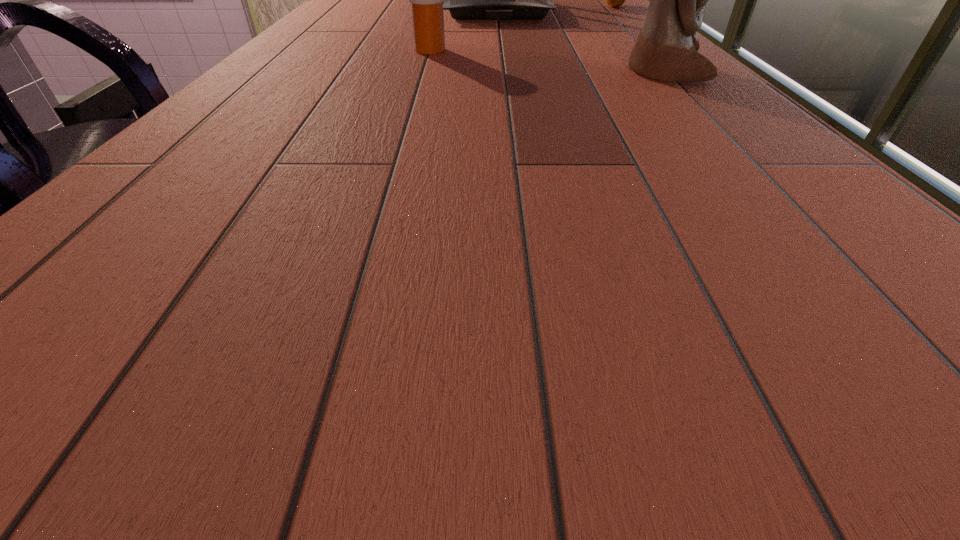
The image size is (960, 540). Identify the location of vacant space in between the router and the figurine. (580, 42).

Find the location of a particular element. This screenshot has width=960, height=540. object that stands as the third closest to the third shortest object is located at coordinates (666, 49).

Locate which object ranks second in proximity to the nearest object. Please provide its 2D coordinates. Your answer should be formatted as a tuple, i.e. [(x, y)], where the tuple contains the x and y coordinates of a point satisfying the conditions above.

[(426, 0)]

Image resolution: width=960 pixels, height=540 pixels. I want to click on vacant point that satisfies the following two spatial constraints: 1. on the back side of the third tallest object; 2. on the right side of the lemon, so click(443, 7).

Find the location of a particular element. The height and width of the screenshot is (540, 960). free space that satisfies the following two spatial constraints: 1. on the front side of the figurine; 2. on the front-facing side of the router is located at coordinates (505, 73).

You are a GUI agent. You are given a task and a screenshot of the screen. Output one action in this format:
    pyautogui.click(x=<x>, y=<y>)
    Task: Click on the vacant region that satisfies the following two spatial constraints: 1. on the front side of the router; 2. on the front-facing side of the tallest object
    Image resolution: width=960 pixels, height=540 pixels.
    Given the screenshot: What is the action you would take?
    pyautogui.click(x=505, y=73)